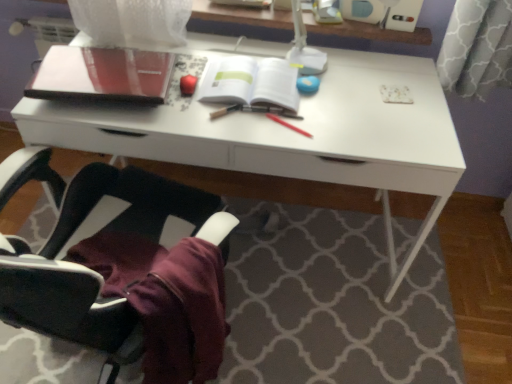
You are a GUI agent. You are given a task and a screenshot of the screen. Output one action in this format:
    pyautogui.click(x=<x>, y=<y>)
    Task: Click on the vacant space behind red matte pen at center, which is the first stationery from right to left
    
    Given the screenshot: What is the action you would take?
    pyautogui.click(x=307, y=105)